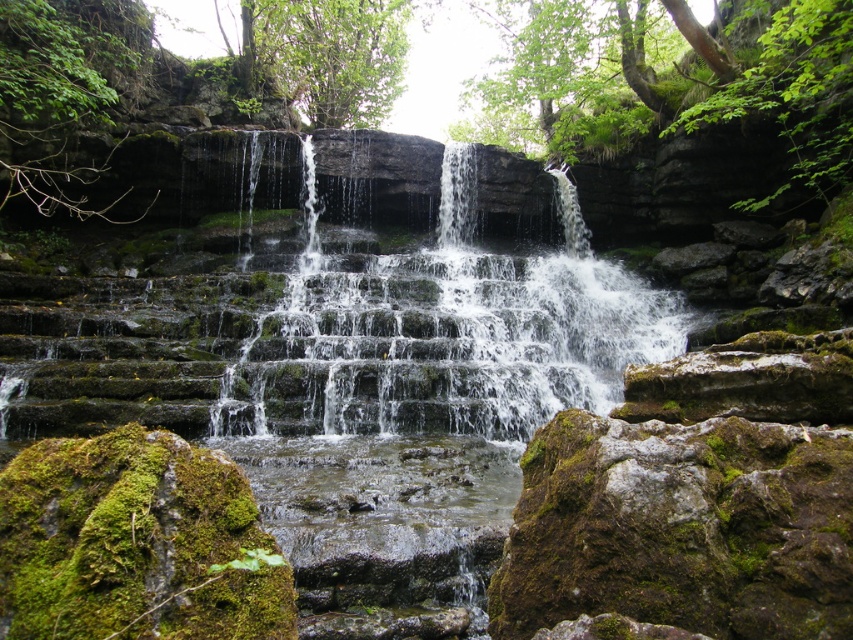
Question: Which point is farther to the camera?

Choices:
 (A) green mossy rocks at center
 (B) green mossy rock at center

Answer: (A)

Question: Is green mossy rock at center smaller than clear water at center?

Choices:
 (A) no
 (B) yes

Answer: (A)

Question: Is green mossy rock at center further to camera compared to clear water at center?

Choices:
 (A) yes
 (B) no

Answer: (B)

Question: Among these points, which one is farthest from the camera?

Choices:
 (A) (445, 218)
 (B) (250, 170)
 (C) (376, 45)

Answer: (C)

Question: Is green mossy rocks at center closer to camera compared to green mossy rock at center?

Choices:
 (A) yes
 (B) no

Answer: (B)

Question: Which point is farther to the camera?

Choices:
 (A) (448, 256)
 (B) (209, 205)

Answer: (B)